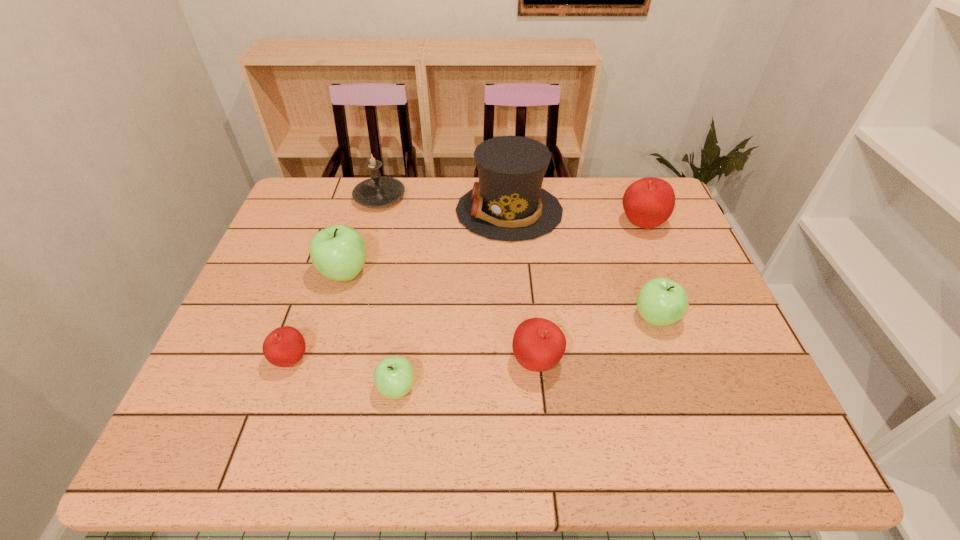
Identify the location of the fourth apple from right to left. The height and width of the screenshot is (540, 960). (394, 376).

The width and height of the screenshot is (960, 540). Find the location of `the second green apple from left to right`. the second green apple from left to right is located at coordinates (394, 376).

Where is `the smallest red apple`? the smallest red apple is located at coordinates (285, 346).

Find the location of `free space located with goggles on the front of the dress hat`. free space located with goggles on the front of the dress hat is located at coordinates (326, 211).

Identify the location of vacant space located with goggles on the front of the dress hat. (436, 211).

The height and width of the screenshot is (540, 960). Find the location of `vacant space located with goggles on the front of the dress hat`. vacant space located with goggles on the front of the dress hat is located at coordinates (385, 211).

This screenshot has width=960, height=540. I want to click on vacant space positioned 0.100m on the front of the candle, so click(370, 234).

Find the location of a particular element. Image resolution: width=960 pixels, height=540 pixels. free region located on the front of the farthest apple is located at coordinates (683, 329).

This screenshot has height=540, width=960. Identify the location of free location located on the left of the second farthest apple. (300, 273).

This screenshot has width=960, height=540. I want to click on vacant space located 0.320m on the right of the fourth apple from left to right, so click(x=705, y=362).